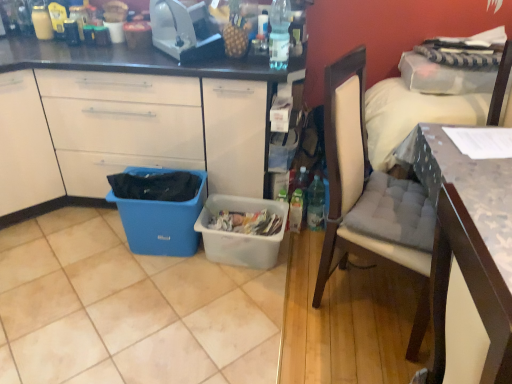
Find the location of `vacant space in front of translucent plastic picnic basket at center`. vacant space in front of translucent plastic picnic basket at center is located at coordinates (242, 304).